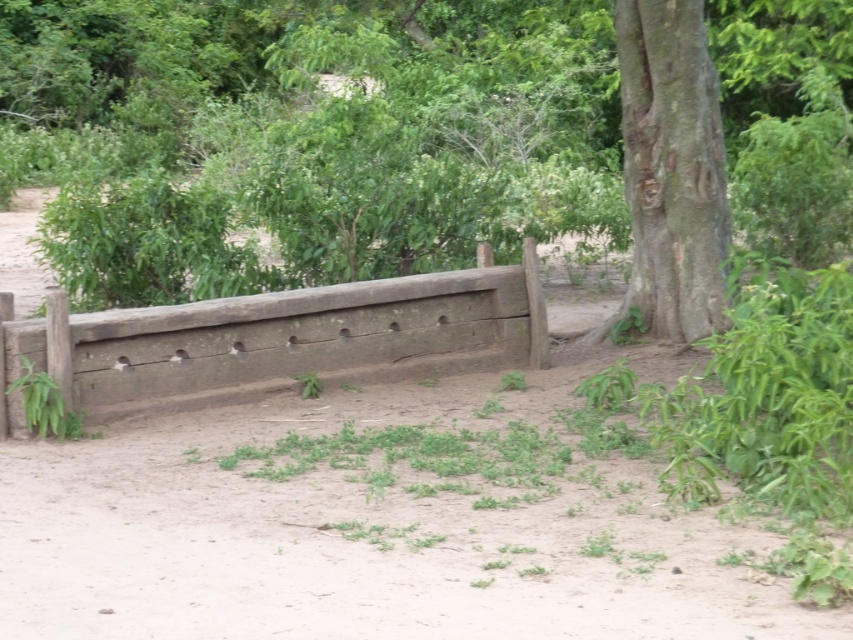
Is brown wood tree at center wider than weathered wood fence at center?

Yes, brown wood tree at center is wider than weathered wood fence at center.

Between point (270, 140) and point (194, 390), which one is positioned behind?

The point (270, 140) is more distant.

Where is `brown wood tree at center`? brown wood tree at center is located at coordinates (426, 140).

Between brown wood tree at center and brown rough bark tree at right, which one is positioned higher?

brown wood tree at center is above.

Does point (347, 241) lie behind point (683, 307)?

Yes, point (347, 241) is behind point (683, 307).

Is point (328, 209) less distant than point (645, 259)?

No.

I want to click on brown wood tree at center, so click(x=426, y=140).

Can you confirm if weathered wood fence at center is taller than brown rough bark tree at right?

In fact, weathered wood fence at center may be shorter than brown rough bark tree at right.

Is weathered wood fence at center positioned behind brown rough bark tree at right?

No, it is not.

Which is in front, point (132, 308) or point (643, 180)?

Point (132, 308) is in front.

Find the location of a particular element. This screenshot has width=853, height=640. weathered wood fence at center is located at coordinates (287, 339).